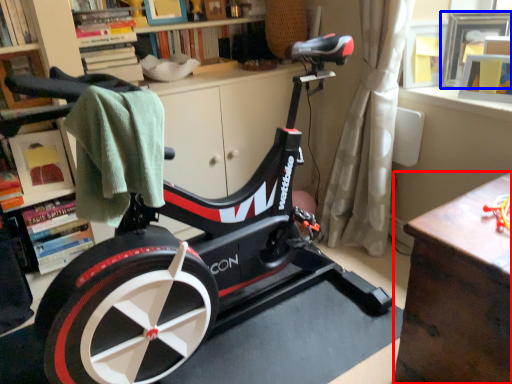
Question: Which of the following is the farthest to the observer, table (highlighted by a red box) or picture frame (highlighted by a blue box)?

Choices:
 (A) table
 (B) picture frame

Answer: (B)